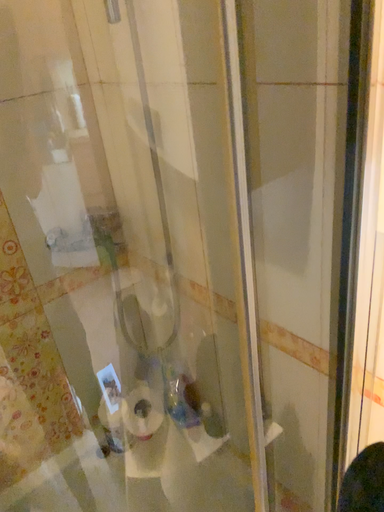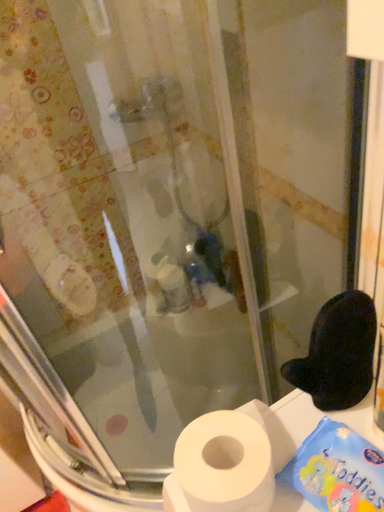
Question: Which way did the camera rotate in the video?

Choices:
 (A) rotated left
 (B) rotated right

Answer: (A)